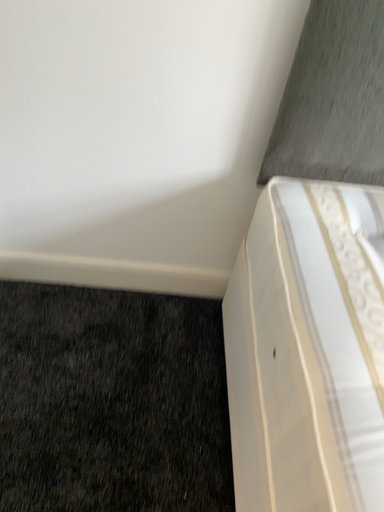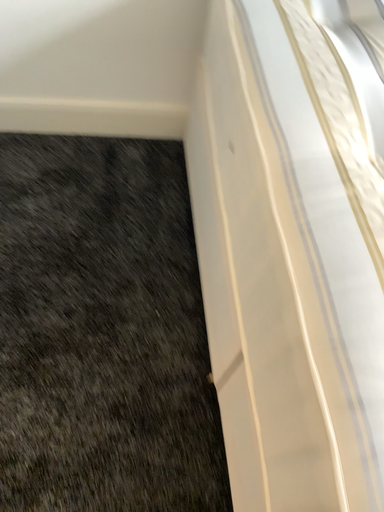
Question: How did the camera likely rotate when shooting the video?

Choices:
 (A) rotated upward
 (B) rotated downward

Answer: (B)